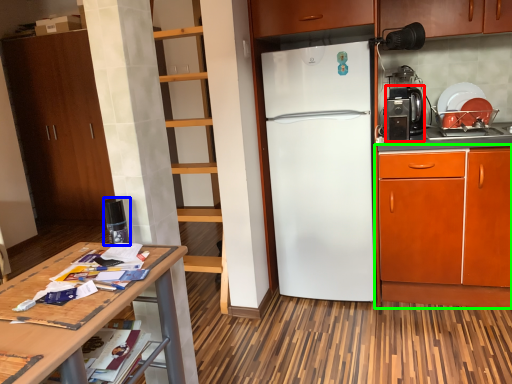
Question: Estimate the real-world distances between objects in this image. Which object is closer to coffee machine (highlighted by a red box), appliance (highlighted by a blue box) or cabinetry (highlighted by a green box)?

Choices:
 (A) appliance
 (B) cabinetry

Answer: (B)